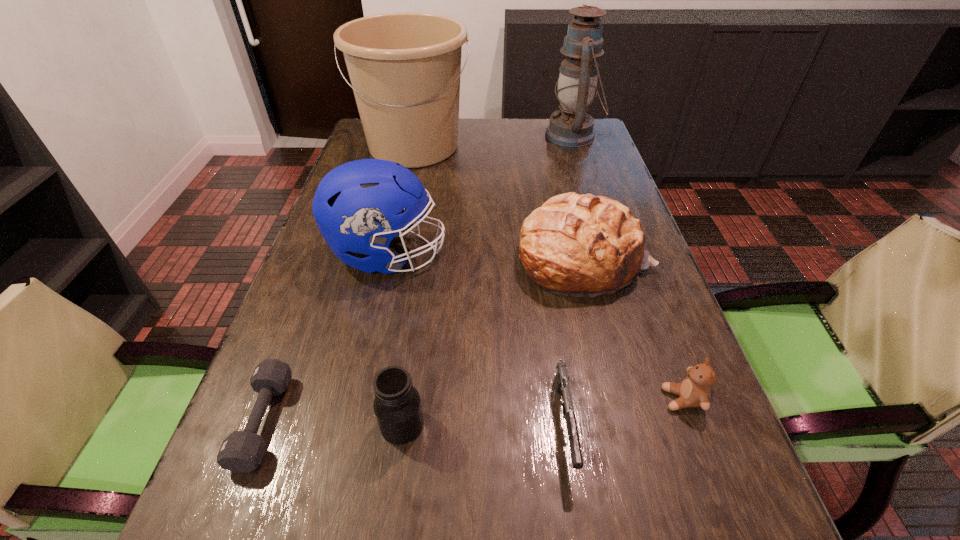
What are the coordinates of `vacant space located 0.090m on the front-facing side of the sixth shortest object` in the screenshot? It's located at (484, 254).

I want to click on vacant space located 0.080m on the front of the fifth shortest object, so click(x=603, y=329).

You are a GUI agent. You are given a task and a screenshot of the screen. Output one action in this format:
    pyautogui.click(x=<x>, y=<y>)
    Task: Click on the vacant space located 0.170m on the left of the fifth tallest object
    
    Given the screenshot: What is the action you would take?
    pyautogui.click(x=279, y=424)

Locate an element on the screen. free space located on the front-facing side of the teddy bear is located at coordinates (528, 399).

This screenshot has width=960, height=540. Find the location of `blank space located 0.060m on the front-facing side of the teddy bear`. blank space located 0.060m on the front-facing side of the teddy bear is located at coordinates (630, 399).

Locate an element on the screen. The width and height of the screenshot is (960, 540). vacant space located on the front-facing side of the teddy bear is located at coordinates (540, 399).

Locate an element on the screen. The width and height of the screenshot is (960, 540). vacant space situated 0.070m at the muzzle end of the second shortest object is located at coordinates (580, 535).

Find the location of a particular element. Image resolution: width=960 pixels, height=540 pixels. free space located on the back of the dumbbell is located at coordinates (x=314, y=288).

Locate an element on the screen. The height and width of the screenshot is (540, 960). oil lamp at the far edge is located at coordinates (572, 127).

Image resolution: width=960 pixels, height=540 pixels. I want to click on bucket that is at the far edge, so (405, 68).